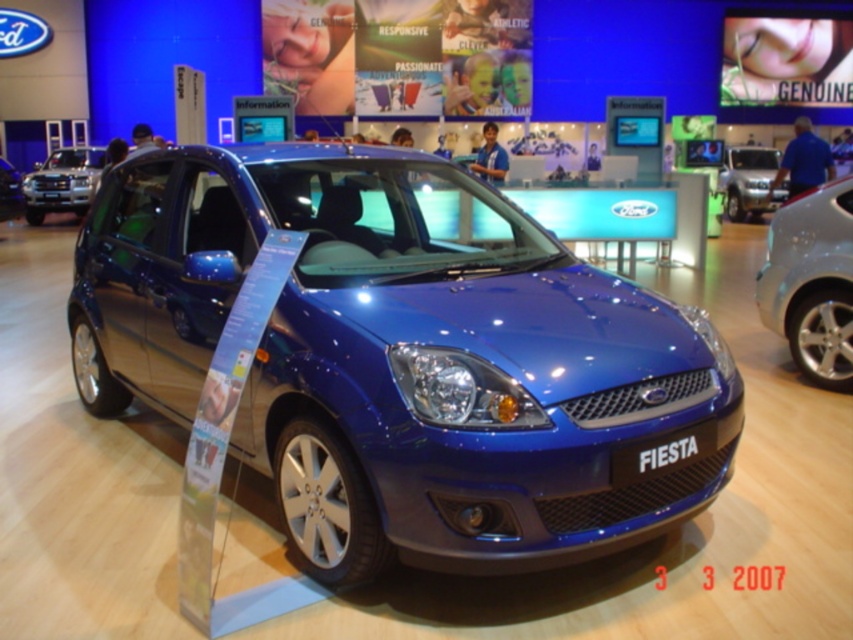
Question: Which object is positioned closest to the satin silver car at right?

Choices:
 (A) glossy blue car at center
 (B) silver metallic minivan at upper right

Answer: (B)

Question: Is satin silver car at right below glossy blue car at center?

Choices:
 (A) no
 (B) yes

Answer: (B)

Question: Which point is farther from the camera taking this photo?

Choices:
 (A) (785, 282)
 (B) (97, 180)

Answer: (B)

Question: Which point is farther to the camera?

Choices:
 (A) satin silver car at right
 (B) glossy metallic car at center
 (C) silver metallic suv at left

Answer: (C)

Question: Is silver metallic suv at left thinner than silver metallic minivan at upper right?

Choices:
 (A) yes
 (B) no

Answer: (B)

Question: From the image, what is the correct spatial relationship of satin silver car at right in relation to silver metallic suv at left?

Choices:
 (A) below
 (B) above

Answer: (A)